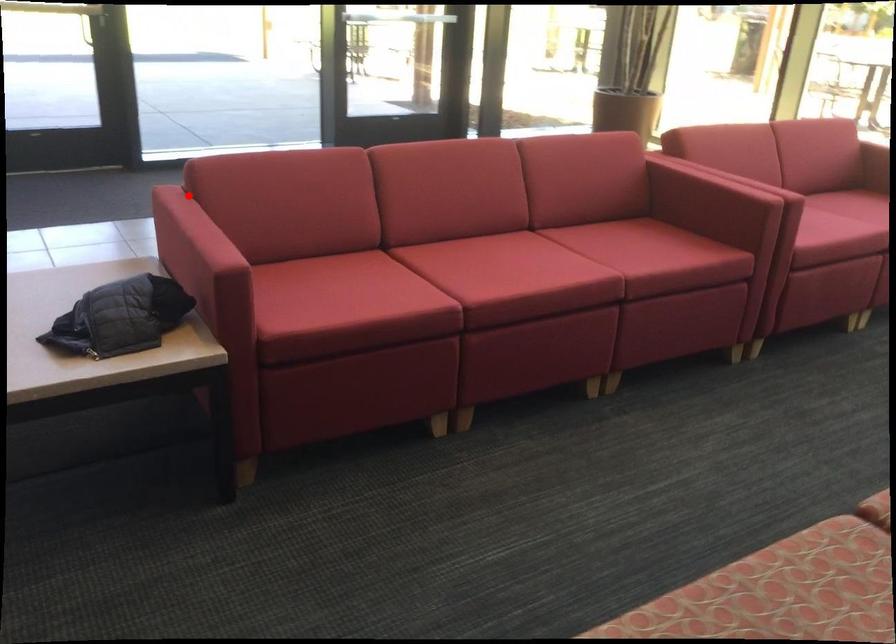
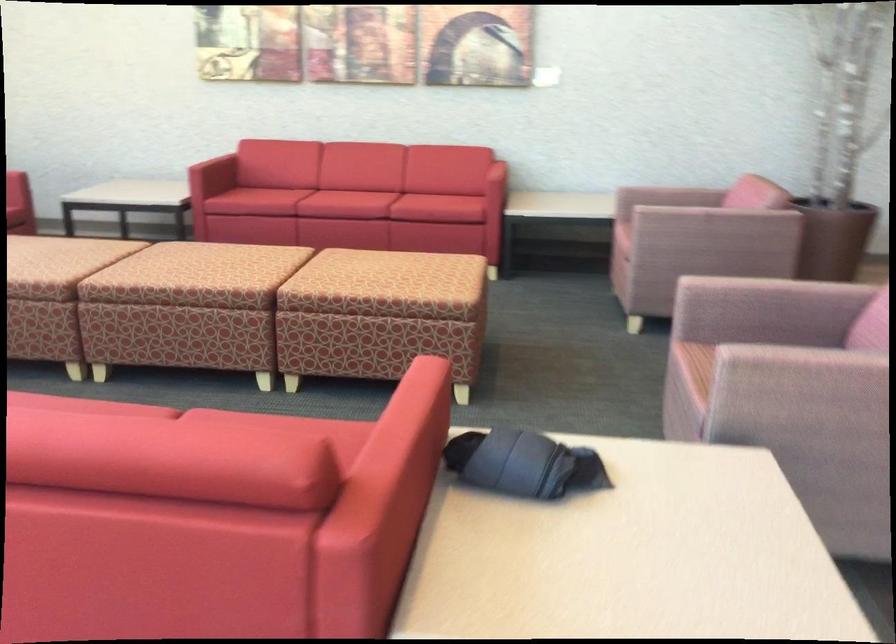
Locate, in the second image, the point that corresponds to the highlighted location in the first image.

(397, 464)